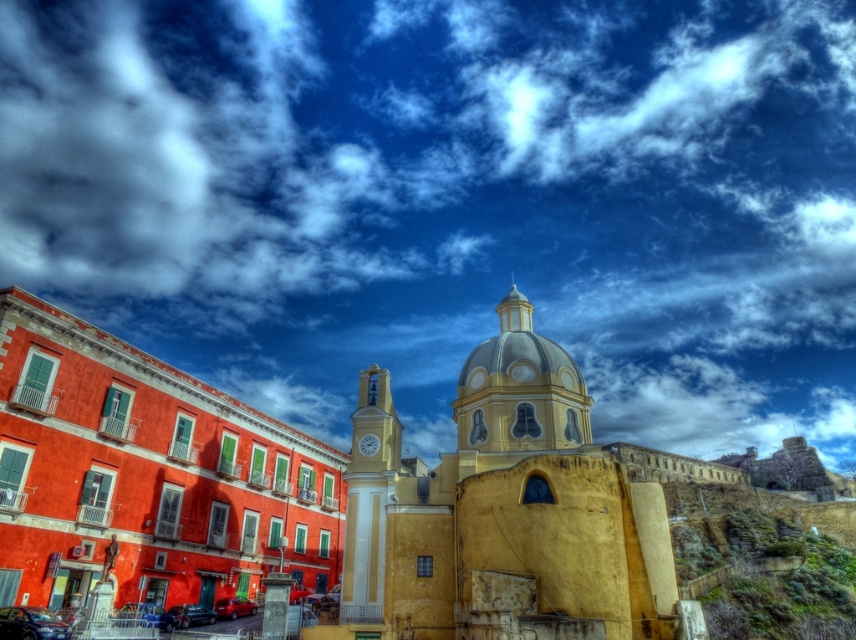
Question: Which of the following is the closest to the observer?

Choices:
 (A) (55, 541)
 (B) (361, 435)
 (C) (211, 346)
 (D) (211, 397)

Answer: (A)

Question: Can you confirm if white fluffy cloud at upper center is positioned below matte orange building at center-left?

Choices:
 (A) no
 (B) yes

Answer: (A)

Question: Is white fluffy cloud at upper center above yellow stucco church at center?

Choices:
 (A) no
 (B) yes

Answer: (B)

Question: Is matte orange building at center-left bigger than yellow stucco church at center?

Choices:
 (A) no
 (B) yes

Answer: (B)

Question: Which point appears closest to the camera in this image?

Choices:
 (A) (185, 484)
 (B) (599, 13)
 (C) (547, 424)
 (D) (82, 394)

Answer: (D)

Question: Which point is closer to the camera?

Choices:
 (A) (312, 312)
 (B) (547, 516)

Answer: (B)